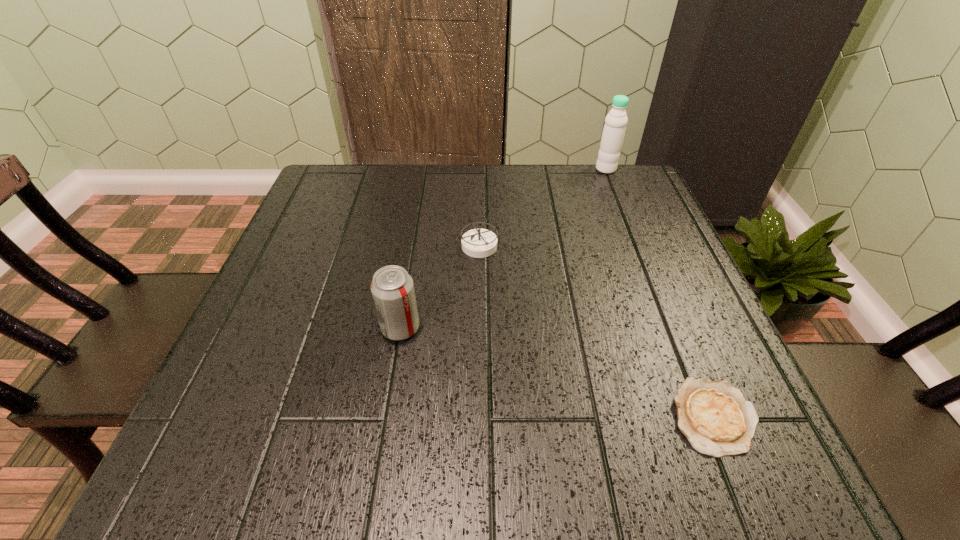
This screenshot has width=960, height=540. In order to click on the tallest object in this screenshot , I will do `click(616, 120)`.

In order to click on water bottle in this screenshot , I will do `click(616, 120)`.

This screenshot has height=540, width=960. I want to click on the leftmost object, so click(392, 288).

The image size is (960, 540). Find the location of `the second nearest object`. the second nearest object is located at coordinates (392, 288).

The width and height of the screenshot is (960, 540). Identify the location of compass. (479, 243).

I want to click on the second shortest object, so click(x=479, y=243).

The image size is (960, 540). I want to click on the nearest object, so click(x=714, y=416).

You are a GUI agent. You are given a task and a screenshot of the screen. Output one action in this format:
    pyautogui.click(x=<x>, y=<y>)
    Task: Click on the quiche
    The height and width of the screenshot is (540, 960).
    Given the screenshot: What is the action you would take?
    pyautogui.click(x=714, y=416)

Identify the location of vacant space located on the front of the farthest object. coord(638,253).

Identify the location of free location located on the left of the second nearest object. This screenshot has width=960, height=540. (279, 328).